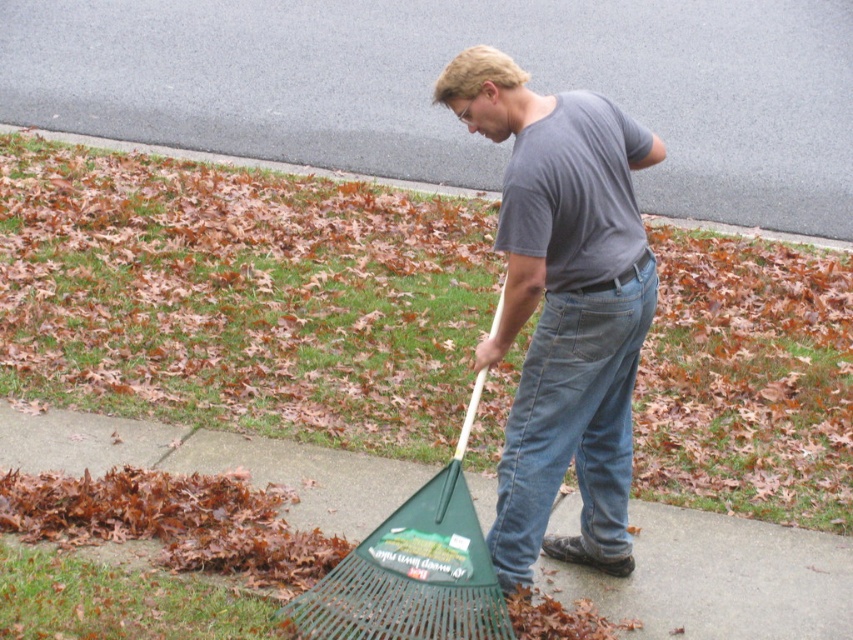
Question: Can you confirm if gray cotton shirt at center is bigger than green plastic rake at lower center?

Choices:
 (A) no
 (B) yes

Answer: (B)

Question: Is green grass at center to the right of jeans at center from the viewer's perspective?

Choices:
 (A) yes
 (B) no

Answer: (B)

Question: Can you confirm if jeans at center is positioned below green grass at lower center?

Choices:
 (A) yes
 (B) no

Answer: (A)

Question: Which point is closer to the camera?

Choices:
 (A) gray cotton shirt at center
 (B) jeans at center
 (C) green grass at lower center

Answer: (A)

Question: Which object is farther from the camera taking this photo?

Choices:
 (A) green grass at center
 (B) jeans at center

Answer: (A)

Question: Estimate the real-world distances between objects in this image. Which object is closer to the green plastic rake at lower center?

Choices:
 (A) gray cotton shirt at center
 (B) gray matte shirt at center
 (C) jeans at center
 (D) green grass at center

Answer: (C)